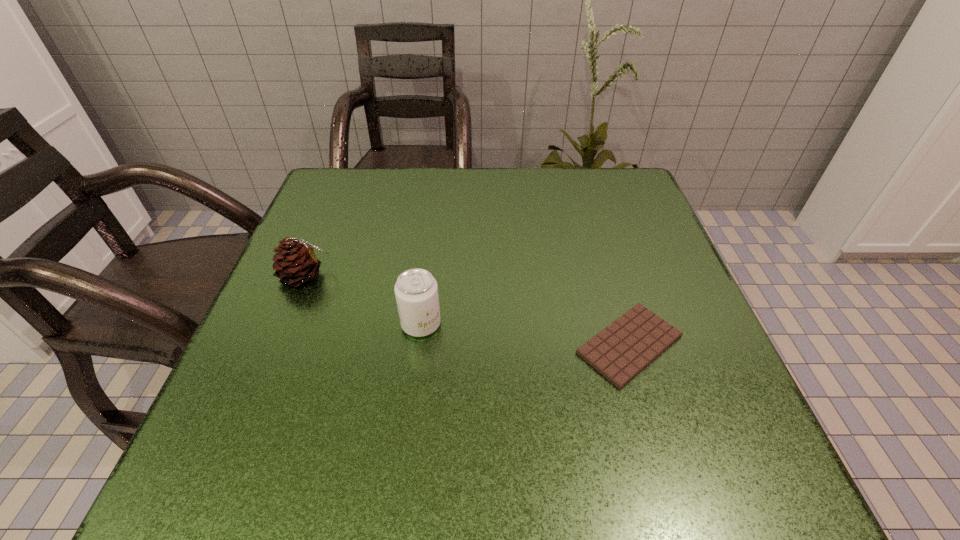
You are a GUI agent. You are given a task and a screenshot of the screen. Output one action in this format:
    pyautogui.click(x=<x>, y=<y>)
    Task: Click on the free spot that satisfies the following two spatial constraints: 1. on the back side of the shortest object; 2. with a leaf charm attached to the farthest object
    
    Given the screenshot: What is the action you would take?
    pyautogui.click(x=609, y=276)

This screenshot has height=540, width=960. In order to click on free point that satisfies the following two spatial constraints: 1. on the back side of the soda can; 2. with a leaf charm attached to the farthest object in this screenshot , I will do `click(427, 276)`.

At what (x,y) coordinates should I click in order to perform the action: click on free space that satisfies the following two spatial constraints: 1. with a leaf charm attached to the leftmost object; 2. on the back side of the chocolate bar. Please return your answer as a coordinate pair (x, y). The height and width of the screenshot is (540, 960). Looking at the image, I should click on (277, 345).

Where is `vacant region that satisfies the following two spatial constraints: 1. with a leaf charm attached to the soda can; 2. on the left side of the pinecone`? The width and height of the screenshot is (960, 540). vacant region that satisfies the following two spatial constraints: 1. with a leaf charm attached to the soda can; 2. on the left side of the pinecone is located at coordinates (285, 324).

Locate an element on the screen. Image resolution: width=960 pixels, height=540 pixels. free point that satisfies the following two spatial constraints: 1. with a leaf charm attached to the leftmost object; 2. on the back side of the soda can is located at coordinates (285, 324).

Identify the location of vacant space that satisfies the following two spatial constraints: 1. with a leaf charm attached to the pinecone; 2. on the left side of the shortest object. (277, 345).

I want to click on vacant point that satisfies the following two spatial constraints: 1. with a leaf charm attached to the pinecone; 2. on the back side of the second object from left to right, so click(285, 324).

The image size is (960, 540). What are the coordinates of `free spot that satisfies the following two spatial constraints: 1. with a leaf charm attached to the farthest object; 2. on the left side of the second object from right to left` in the screenshot? It's located at point(285,324).

You are a GUI agent. You are given a task and a screenshot of the screen. Output one action in this format:
    pyautogui.click(x=<x>, y=<y>)
    Task: Click on the vacant space that satisfies the following two spatial constraints: 1. with a leaf charm attached to the shortest object; 2. on the right side of the farthest object
    
    Given the screenshot: What is the action you would take?
    pyautogui.click(x=277, y=345)

I want to click on vacant space that satisfies the following two spatial constraints: 1. with a leaf charm attached to the leftmost object; 2. on the right side of the soda can, so click(x=285, y=324).